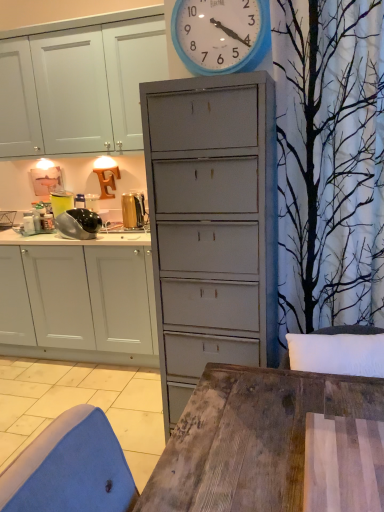
Locate an element on the screen. The height and width of the screenshot is (512, 384). vacant location behind gold metallic toaster at upper left, which is counted as the first appliance, starting from the right is located at coordinates (133, 227).